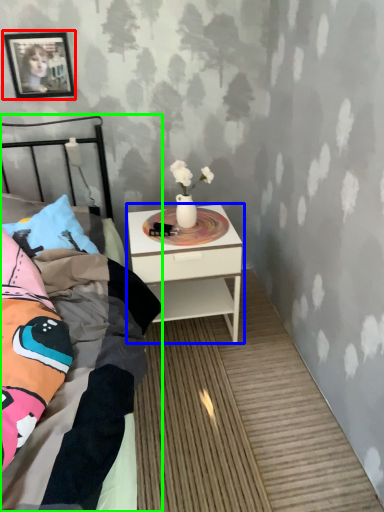
Question: Which is nearer to the picture frame (highlighted by a red box)? nightstand (highlighted by a blue box) or bed (highlighted by a green box).

Choices:
 (A) nightstand
 (B) bed

Answer: (A)